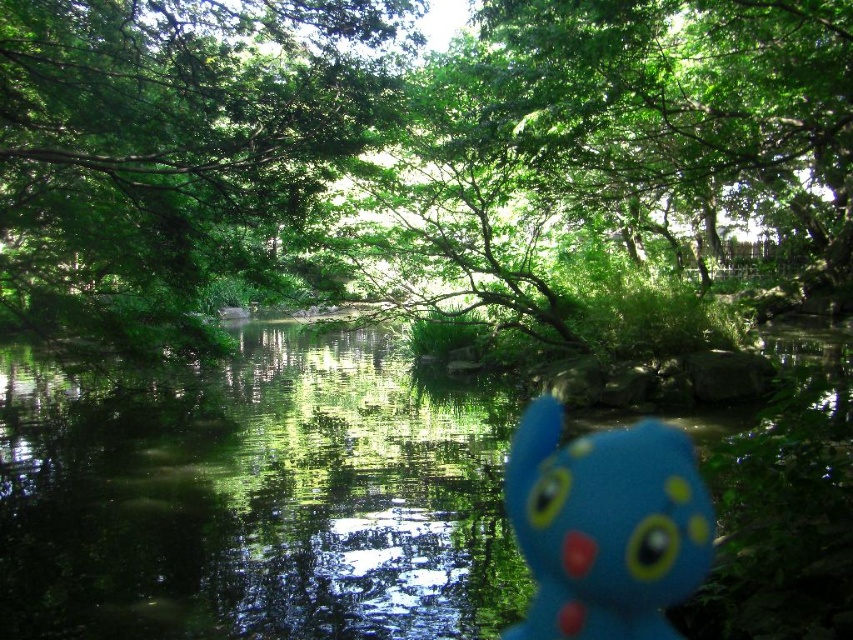
Between green leafy tree at upper center and blue rubber toy at center, which one is positioned higher?

Positioned higher is green leafy tree at upper center.

Can you confirm if green leafy tree at upper center is positioned to the left of blue rubber toy at center?

Indeed, green leafy tree at upper center is positioned on the left side of blue rubber toy at center.

Who is more distant from viewer, (149, 336) or (550, 545)?

The point (149, 336) is behind.

You are a GUI agent. You are given a task and a screenshot of the screen. Output one action in this format:
    pyautogui.click(x=<x>, y=<y>)
    Task: Click on the green leafy tree at upper center
    The image size is (853, 640).
    Given the screenshot: What is the action you would take?
    click(171, 141)

Which is in front, point (426, 227) or point (323, 339)?

Point (426, 227)

Can you confirm if green leafy tree at center is bigger than green reflective water at center?

Yes.

Is point (289, 248) more distant than point (256, 627)?

Yes, point (289, 248) is behind point (256, 627).

Locate an element on the screen. The image size is (853, 640). green leafy tree at center is located at coordinates (415, 152).

This screenshot has height=640, width=853. I want to click on green reflective water at center, so click(x=254, y=497).

Which of these two, green reflective water at center or green leafy tree at upper center, stands shorter?

green leafy tree at upper center

Locate an element on the screen. Image resolution: width=853 pixels, height=640 pixels. green reflective water at center is located at coordinates (254, 497).